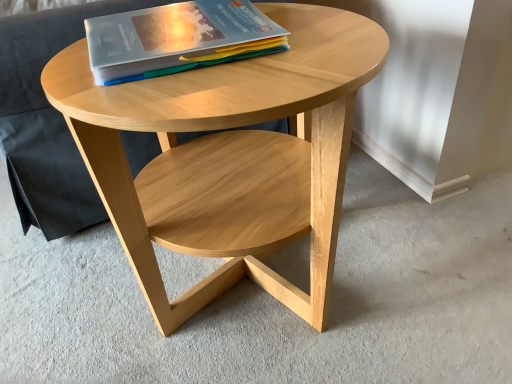
This screenshot has height=384, width=512. What do you see at coordinates (229, 157) in the screenshot?
I see `natural wood coffee table at center` at bounding box center [229, 157].

Where is `natural wood coffee table at center`? The width and height of the screenshot is (512, 384). natural wood coffee table at center is located at coordinates pyautogui.click(x=229, y=157).

The width and height of the screenshot is (512, 384). Describe the element at coordinates (170, 36) in the screenshot. I see `matte plastic book at upper center` at that location.

The height and width of the screenshot is (384, 512). In order to click on matte plastic book at upper center in this screenshot , I will do `click(170, 36)`.

Measure the distance between matte plastic book at upper center and camera.

A: The depth of matte plastic book at upper center is 24.68 inches.

The width and height of the screenshot is (512, 384). In order to click on natural wood coffee table at center in this screenshot , I will do `click(229, 157)`.

From the picture: Is matte plastic book at upper center at the right side of natural wood coffee table at center?

No, matte plastic book at upper center is not to the right of natural wood coffee table at center.

Which object is further away from the camera, matte plastic book at upper center or natural wood coffee table at center?

matte plastic book at upper center is further away from the camera.

Which is behind, point (196, 32) or point (298, 24)?

The point (298, 24) is behind.

From the image's perspective, which one is positioned lower, matte plastic book at upper center or natural wood coffee table at center?

natural wood coffee table at center, from the image's perspective.

From a real-world perspective, is matte plastic book at upper center above or below natural wood coffee table at center?

matte plastic book at upper center is situated higher than natural wood coffee table at center in the real world.

Is matte plastic book at upper center wider than natural wood coffee table at center?

No.

Can you confirm if matte plastic book at upper center is shorter than natural wood coffee table at center?

Indeed, matte plastic book at upper center has a lesser height compared to natural wood coffee table at center.

Looking at the image, does matte plastic book at upper center seem bigger or smaller compared to natural wood coffee table at center?

Considering their sizes, matte plastic book at upper center takes up less space than natural wood coffee table at center.

Based on the photo, is matte plastic book at upper center spatially inside natural wood coffee table at center, or outside of it?

matte plastic book at upper center is located beyond the bounds of natural wood coffee table at center.

Would you say matte plastic book at upper center is a long distance from natural wood coffee table at center?

matte plastic book at upper center is near natural wood coffee table at center, not far away.

Is matte plastic book at upper center facing away from natural wood coffee table at center?

No, natural wood coffee table at center is not at the back of matte plastic book at upper center.

Can you tell me how much matte plastic book at upper center and natural wood coffee table at center differ in facing direction?

There is a 2.71-degree angle between the facing directions of matte plastic book at upper center and natural wood coffee table at center.

Where is `coffee table lying on the right of matte plastic book at upper center`? coffee table lying on the right of matte plastic book at upper center is located at coordinates (229, 157).

Considering the positions of objects natural wood coffee table at center and matte plastic book at upper center in the image provided, who is more to the left, natural wood coffee table at center or matte plastic book at upper center?

matte plastic book at upper center.

Consider the image. Which object is closer to the camera taking this photo, natural wood coffee table at center or matte plastic book at upper center?

natural wood coffee table at center is in front.

Which is in front, point (317, 103) or point (170, 38)?

The point (317, 103) is more forward.

From the image's perspective, is natural wood coffee table at center located beneath matte plastic book at upper center?

Yes, from the image's perspective, natural wood coffee table at center is below matte plastic book at upper center.

From a real-world perspective, which object rests below the other?

natural wood coffee table at center is physically lower.

Can you confirm if natural wood coffee table at center is wider than matte plastic book at upper center?

Yes, natural wood coffee table at center is wider than matte plastic book at upper center.

Who is taller, natural wood coffee table at center or matte plastic book at upper center?

natural wood coffee table at center.

Considering the sizes of objects natural wood coffee table at center and matte plastic book at upper center in the image provided, who is smaller, natural wood coffee table at center or matte plastic book at upper center?

With smaller size is matte plastic book at upper center.

Would you say natural wood coffee table at center contains matte plastic book at upper center?

No, natural wood coffee table at center does not contain matte plastic book at upper center.

Are natural wood coffee table at center and matte plastic book at upper center located far from each other?

natural wood coffee table at center is near matte plastic book at upper center, not far away.

Is natural wood coffee table at center facing towards matte plastic book at upper center?

No, natural wood coffee table at center is not turned towards matte plastic book at upper center.

In the image, there is a matte plastic book at upper center. Where is `coffee table below it (from a real-world perspective)`? This screenshot has height=384, width=512. coffee table below it (from a real-world perspective) is located at coordinates (229, 157).

Locate an element on the screen. Image resolution: width=512 pixels, height=384 pixels. book behind the natural wood coffee table at center is located at coordinates (170, 36).

Where is `coffee table that appears below the matte plastic book at upper center (from a real-world perspective)`? Image resolution: width=512 pixels, height=384 pixels. coffee table that appears below the matte plastic book at upper center (from a real-world perspective) is located at coordinates (229, 157).